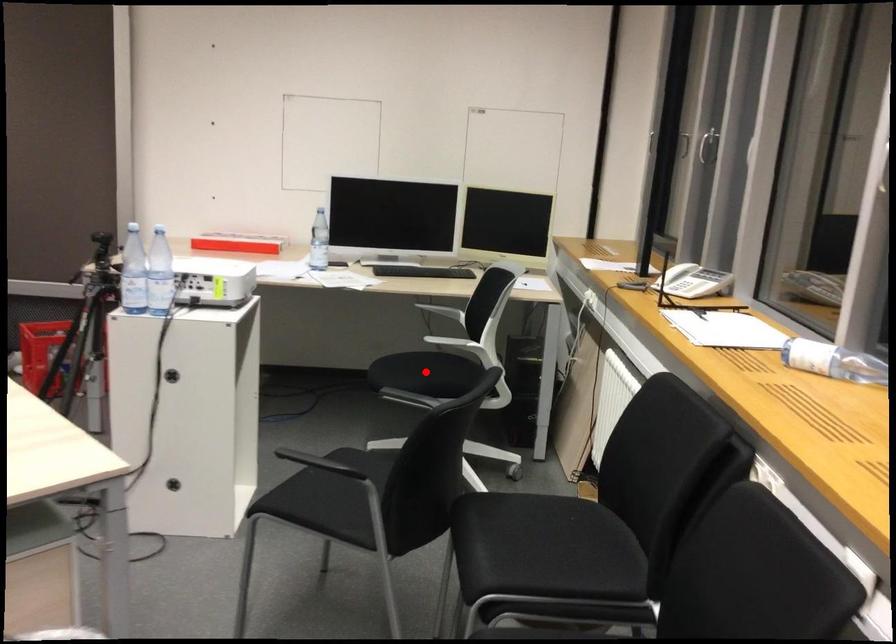
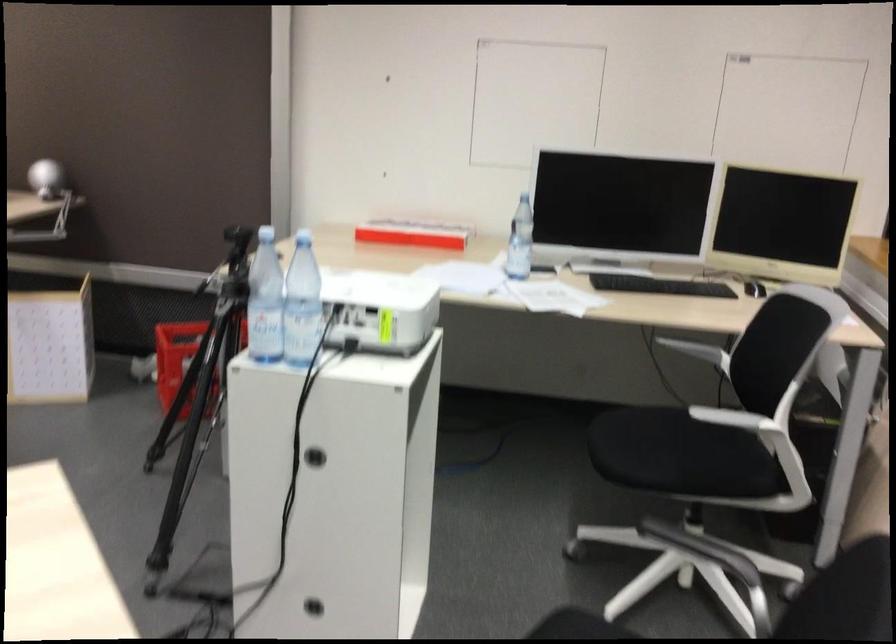
Question: A red point is marked in image1. In image2, is the corresponding 3D point closer to the camera or farther? Reply with the corresponding letter.

Choices:
 (A) The corresponding 3D point is closer.
 (B) The corresponding 3D point is farther.

Answer: (A)